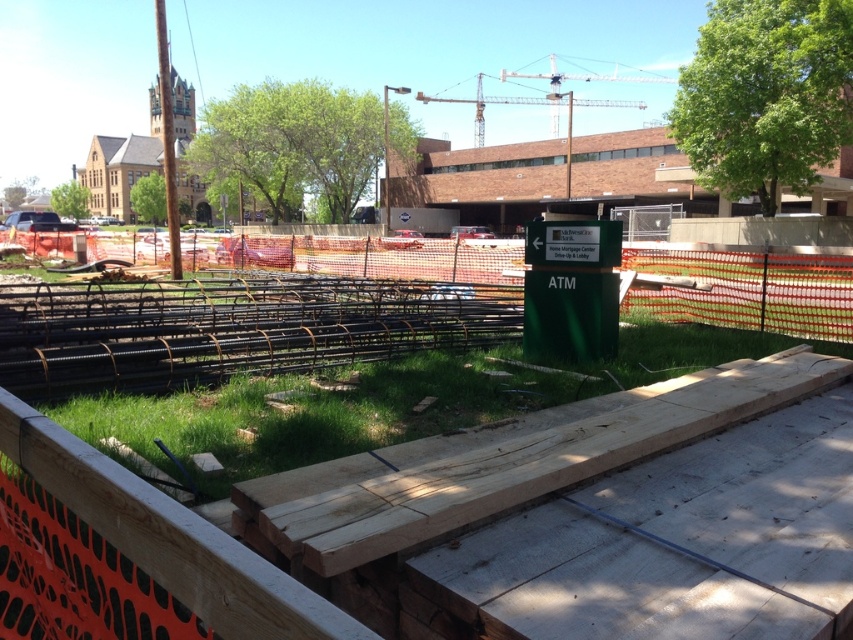
Question: Among these points, which one is farthest from the camera?

Choices:
 (A) (465, 376)
 (B) (799, 266)
 (C) (231, 538)

Answer: (B)

Question: Which of the following is the farthest from the observer?

Choices:
 (A) green wood construction at center
 (B) green grass at center

Answer: (B)

Question: Is green wood construction at center smaller than orange mesh fence at center?

Choices:
 (A) yes
 (B) no

Answer: (A)

Question: Among these points, which one is farthest from the camera?

Choices:
 (A) (579, 461)
 (B) (663, 280)

Answer: (B)

Question: Can you confirm if green wood construction at center is positioned to the right of orange mesh fence at center?

Choices:
 (A) no
 (B) yes

Answer: (B)

Question: Is green wood construction at center further to the viewer compared to green grass at center?

Choices:
 (A) no
 (B) yes

Answer: (A)